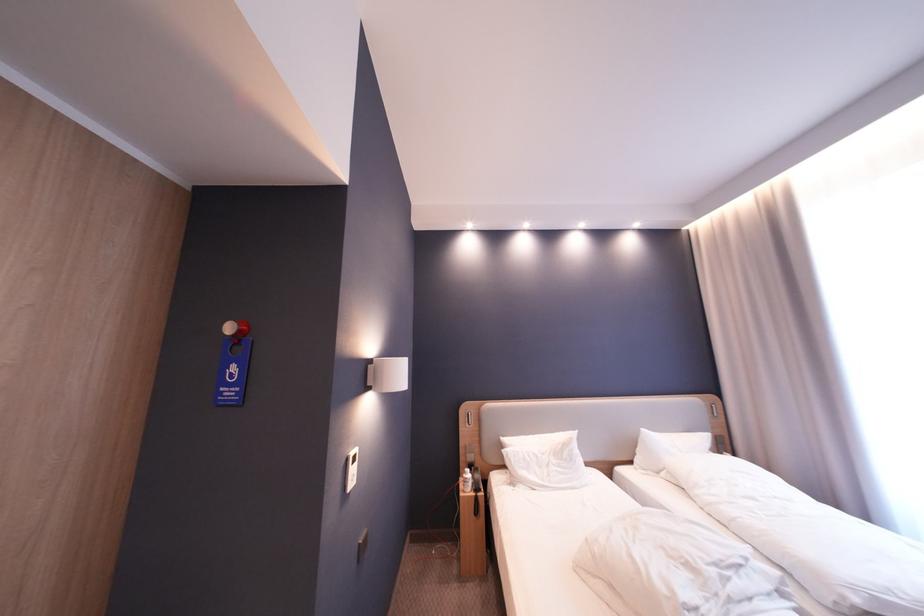
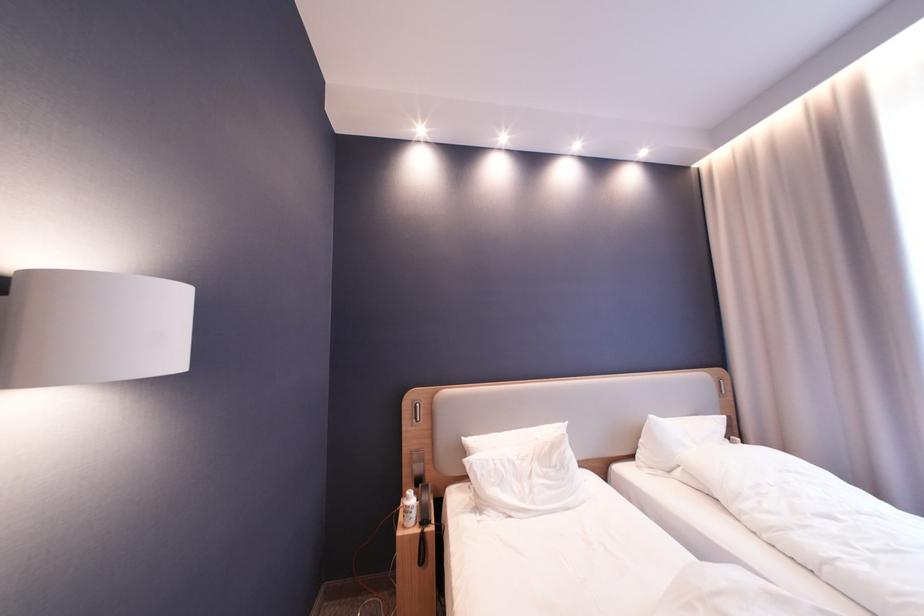
Question: The images are taken continuously from a first-person perspective. In which direction are you moving?

Choices:
 (A) Left
 (B) Right
 (C) Forward
 (D) Backward

Answer: (C)